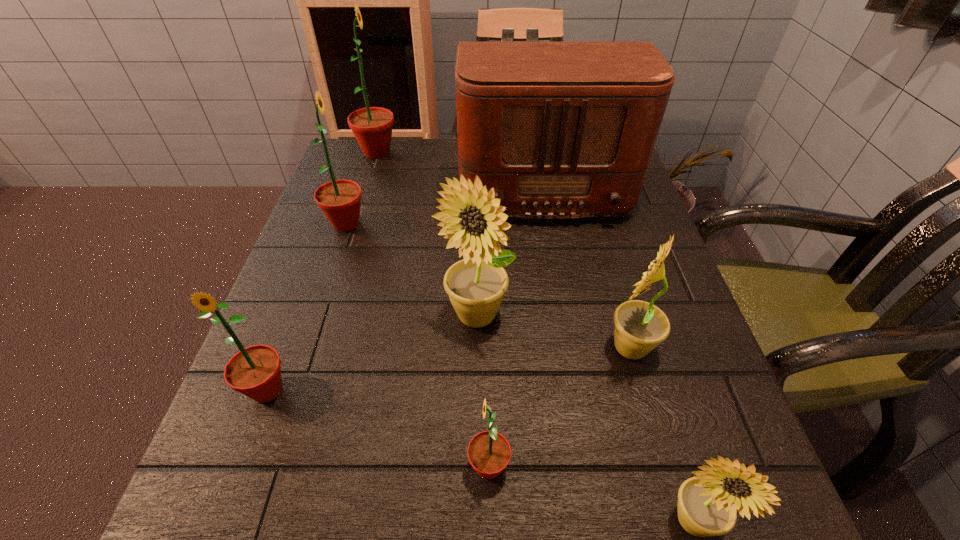
This screenshot has height=540, width=960. In the image, there is a desktop. Identify the location of vacant space at the right edge. (622, 248).

Identify the location of vacant region between the rightmost green sunflower and the third smallest green sunflower. The width and height of the screenshot is (960, 540). (418, 345).

In order to click on vacant region between the third biggest green sunflower and the second farthest sunflower in this screenshot , I will do `click(306, 307)`.

Find the location of a particular element. The image size is (960, 540). vacant area that lies between the leftmost yellow sunflower and the sixth nearest sunflower is located at coordinates pos(411,270).

Locate an element on the screen. The image size is (960, 540). vacant region between the second nearest object and the brown radio receiver is located at coordinates (516, 325).

The width and height of the screenshot is (960, 540). Find the location of `free space between the second smallest green sunflower and the tallest sunflower`. free space between the second smallest green sunflower and the tallest sunflower is located at coordinates (322, 271).

The width and height of the screenshot is (960, 540). I want to click on vacant space that is in between the second biggest yellow sunflower and the third biggest green sunflower, so click(448, 369).

At what (x,y) coordinates should I click in order to perform the action: click on vacant area that lies between the radio receiver and the leftmost yellow sunflower. Please return your answer as a coordinate pair (x, y). This screenshot has width=960, height=540. Looking at the image, I should click on (509, 250).

Locate which object ranks third in proximity to the radio receiver. Please provide its 2D coordinates. Your answer should be formatted as a tuple, i.e. [(x, y)], where the tuple contains the x and y coordinates of a point satisfying the conditions above.

[(340, 200)]

Choose which object is the fourth nearest neighbor to the second farthest sunflower. Please provide its 2D coordinates. Your answer should be formatted as a tuple, i.e. [(x, y)], where the tuple contains the x and y coordinates of a point satisfying the conditions above.

[(255, 371)]